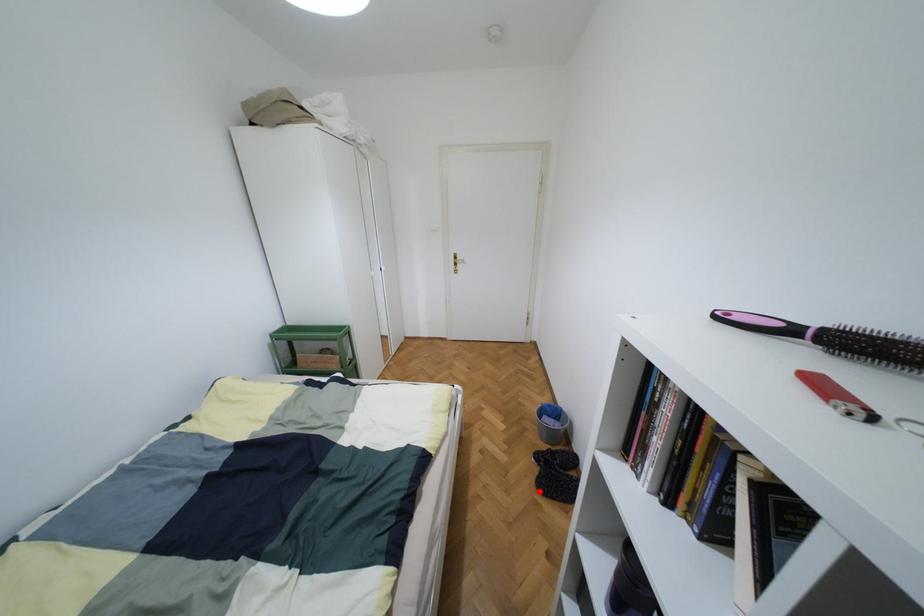
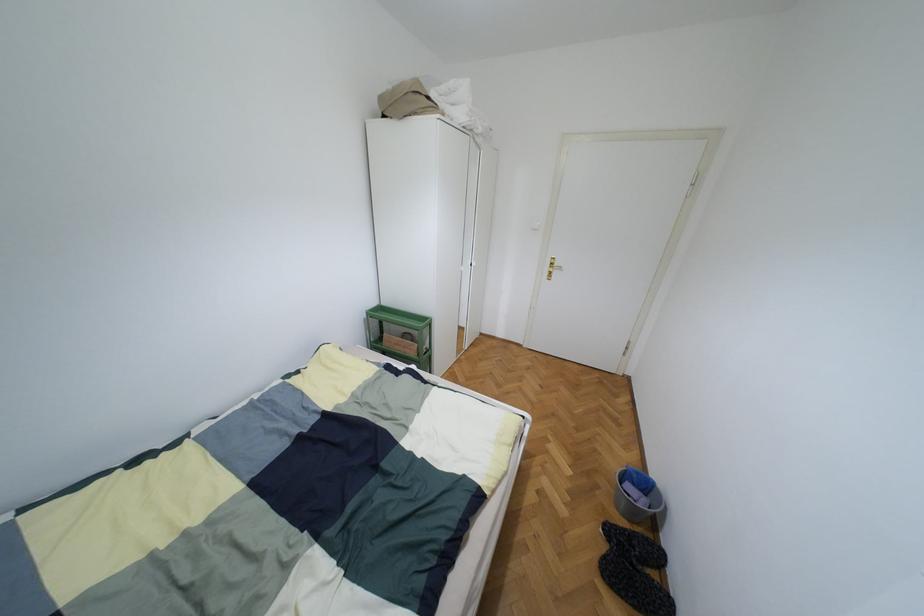
Find the pixel in the second image that matches the highlighted location in the first image.

(602, 577)